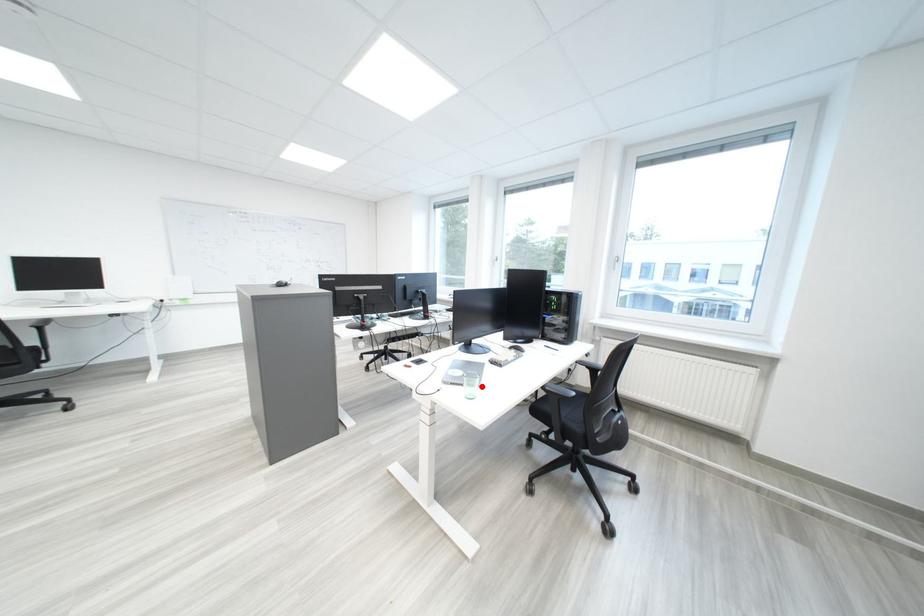
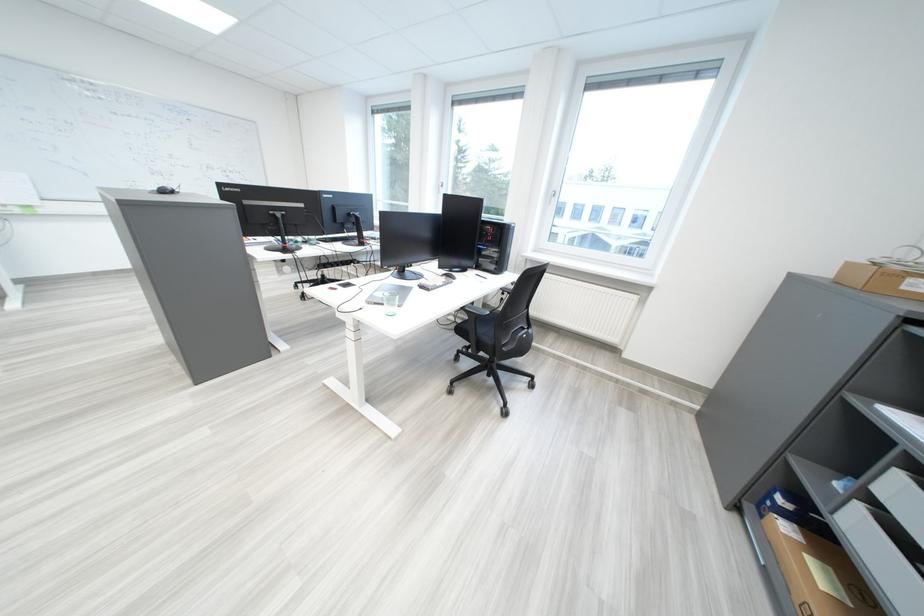
Locate, in the second image, the point that corresponds to the highlighted location in the first image.

(402, 305)